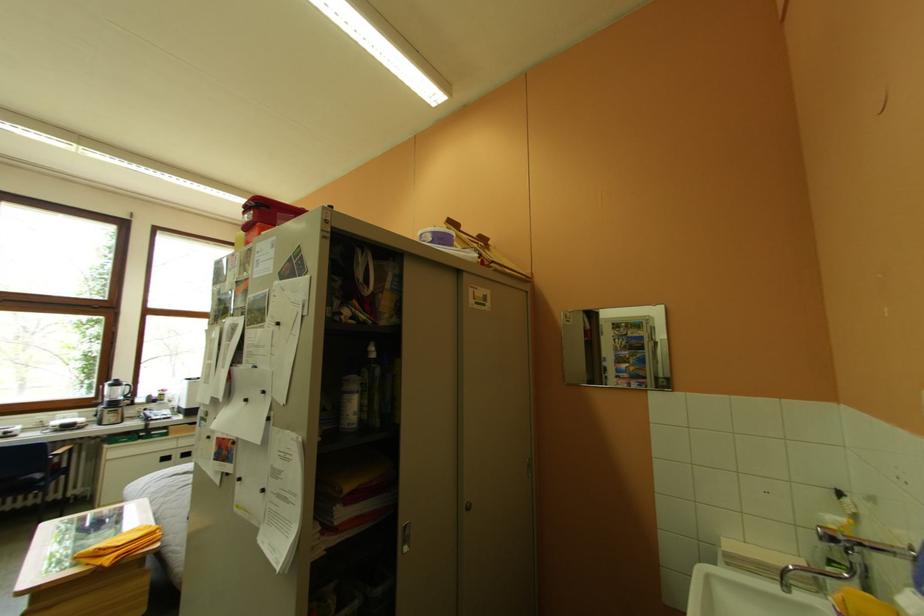
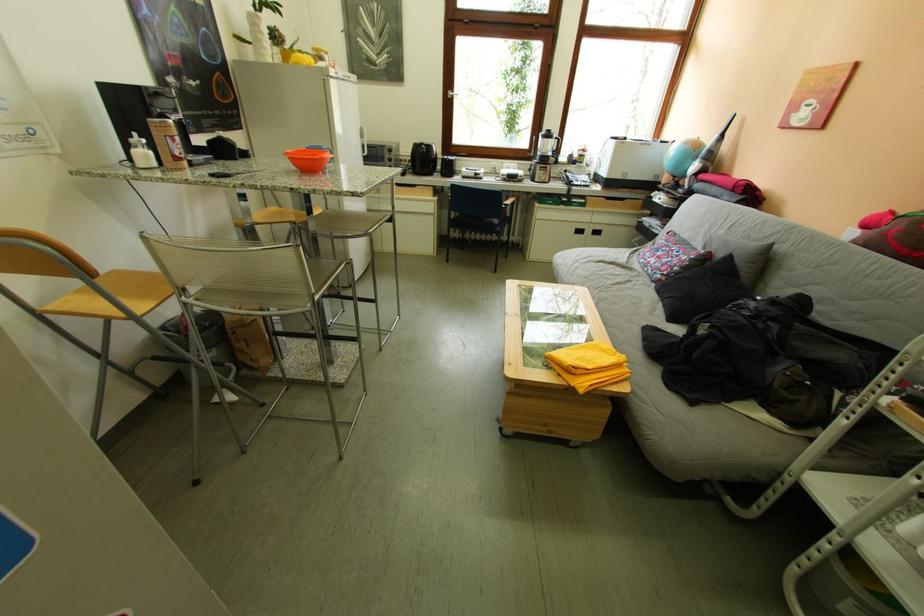
Locate, in the second image, the point that corresponds to (x=49, y=495) in the first image.

(507, 238)